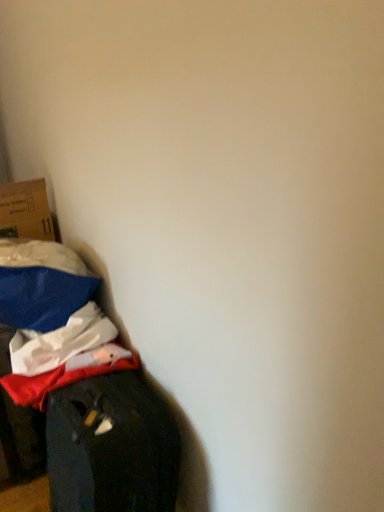
Question: Is cardboard box at left further to camera compared to velvet-like fabric couch at lower left?

Choices:
 (A) yes
 (B) no

Answer: (A)

Question: Can you confirm if cardboard box at left is bigger than velvet-like fabric couch at lower left?

Choices:
 (A) no
 (B) yes

Answer: (A)

Question: Can you confirm if cardboard box at left is positioned to the right of velvet-like fabric couch at lower left?

Choices:
 (A) yes
 (B) no

Answer: (B)

Question: Is cardboard box at left next to velvet-like fabric couch at lower left?

Choices:
 (A) no
 (B) yes

Answer: (A)

Question: Could velvet-like fabric couch at lower left be considered to be inside cardboard box at left?

Choices:
 (A) no
 (B) yes

Answer: (A)

Question: From the image's perspective, is cardboard box at left beneath velvet-like fabric couch at lower left?

Choices:
 (A) yes
 (B) no

Answer: (B)

Question: From a real-world perspective, is velvet-like fabric couch at lower left located beneath cardboard box at left?

Choices:
 (A) no
 (B) yes

Answer: (B)

Question: From the image's perspective, is velvet-like fabric couch at lower left located beneath cardboard box at left?

Choices:
 (A) yes
 (B) no

Answer: (A)

Question: Can you confirm if velvet-like fabric couch at lower left is smaller than cardboard box at left?

Choices:
 (A) no
 (B) yes

Answer: (A)

Question: From a real-world perspective, is velvet-like fabric couch at lower left on cardboard box at left?

Choices:
 (A) yes
 (B) no

Answer: (B)

Question: Is velvet-like fabric couch at lower left taller than cardboard box at left?

Choices:
 (A) yes
 (B) no

Answer: (A)

Question: Is cardboard box at left surrounded by velvet-like fabric couch at lower left?

Choices:
 (A) no
 (B) yes

Answer: (A)

Question: Is cardboard box at left taller or shorter than velvet-like fabric couch at lower left?

Choices:
 (A) short
 (B) tall

Answer: (A)